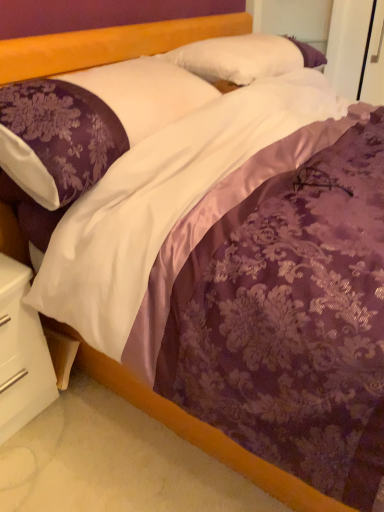
Question: Is white satin pillow at upper center, marked as the first pillow in a back-to-front arrangement, positioned in front of white glossy nightstand at lower left?

Choices:
 (A) no
 (B) yes

Answer: (A)

Question: Is white satin pillow at upper center, marked as the second pillow in a front-to-back arrangement, aimed at white glossy nightstand at lower left?

Choices:
 (A) yes
 (B) no

Answer: (B)

Question: Does white satin pillow at upper center, marked as the second pillow in a front-to-back arrangement, appear on the right side of white glossy nightstand at lower left?

Choices:
 (A) no
 (B) yes

Answer: (B)

Question: Can you confirm if white satin pillow at upper center, marked as the second pillow in a front-to-back arrangement, is bigger than white glossy nightstand at lower left?

Choices:
 (A) no
 (B) yes

Answer: (B)

Question: Is white satin pillow at upper center, marked as the second pillow in a front-to-back arrangement, far away from white glossy nightstand at lower left?

Choices:
 (A) yes
 (B) no

Answer: (A)

Question: From a real-world perspective, is purple satin pillow at upper left, which is the 2th pillow from back to front, above or below white glossy nightstand at lower left?

Choices:
 (A) below
 (B) above

Answer: (B)

Question: In terms of size, does purple satin pillow at upper left, positioned as the 1th pillow in front-to-back order, appear bigger or smaller than white glossy nightstand at lower left?

Choices:
 (A) big
 (B) small

Answer: (A)

Question: Is purple satin pillow at upper left, which is the 2th pillow from back to front, wider or thinner than white glossy nightstand at lower left?

Choices:
 (A) thin
 (B) wide

Answer: (B)

Question: Which is correct: purple satin pillow at upper left, positioned as the 1th pillow in front-to-back order, is inside white glossy nightstand at lower left, or outside of it?

Choices:
 (A) outside
 (B) inside

Answer: (A)

Question: From the image's perspective, is white glossy nightstand at lower left above or below purple satin pillow at upper left, which is the 2th pillow from back to front?

Choices:
 (A) above
 (B) below

Answer: (B)

Question: Is white glossy nightstand at lower left inside the boundaries of purple satin pillow at upper left, positioned as the 1th pillow in front-to-back order, or outside?

Choices:
 (A) outside
 (B) inside

Answer: (A)

Question: Is white glossy nightstand at lower left wider or thinner than purple satin pillow at upper left, positioned as the 1th pillow in front-to-back order?

Choices:
 (A) wide
 (B) thin

Answer: (B)

Question: Is white glossy nightstand at lower left taller or shorter than purple satin pillow at upper left, which is the 2th pillow from back to front?

Choices:
 (A) short
 (B) tall

Answer: (B)

Question: Relative to white glossy nightstand at lower left, is white satin pillow at upper center, marked as the first pillow in a back-to-front arrangement, in front or behind?

Choices:
 (A) front
 (B) behind

Answer: (B)

Question: Considering the positions of white satin pillow at upper center, marked as the first pillow in a back-to-front arrangement, and white glossy nightstand at lower left in the image, is white satin pillow at upper center, marked as the first pillow in a back-to-front arrangement, wider or thinner than white glossy nightstand at lower left?

Choices:
 (A) thin
 (B) wide

Answer: (B)